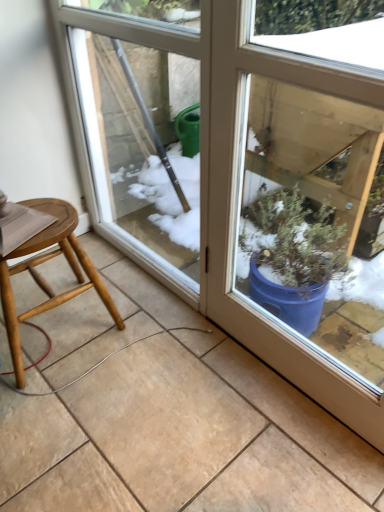
Question: Could you tell me if light wood stool at lower left is facing transparent glass screen door at center?

Choices:
 (A) no
 (B) yes

Answer: (A)

Question: Is light wood stool at lower left facing away from transparent glass screen door at center?

Choices:
 (A) yes
 (B) no

Answer: (B)

Question: From a real-world perspective, is light wood stool at lower left positioned under transparent glass screen door at center based on gravity?

Choices:
 (A) yes
 (B) no

Answer: (A)

Question: Is light wood stool at lower left shorter than transparent glass screen door at center?

Choices:
 (A) no
 (B) yes

Answer: (B)

Question: Considering the relative sizes of light wood stool at lower left and transparent glass screen door at center in the image provided, is light wood stool at lower left wider than transparent glass screen door at center?

Choices:
 (A) no
 (B) yes

Answer: (B)

Question: Can you confirm if light wood stool at lower left is positioned to the right of transparent glass screen door at center?

Choices:
 (A) yes
 (B) no

Answer: (B)

Question: From a real-world perspective, is transparent glass screen door at center located beneath light wood stool at lower left?

Choices:
 (A) no
 (B) yes

Answer: (A)

Question: Can we say transparent glass screen door at center lies outside light wood stool at lower left?

Choices:
 (A) no
 (B) yes

Answer: (B)

Question: From the image's perspective, would you say transparent glass screen door at center is positioned over light wood stool at lower left?

Choices:
 (A) no
 (B) yes

Answer: (B)

Question: Is light wood stool at lower left surrounded by transparent glass screen door at center?

Choices:
 (A) no
 (B) yes

Answer: (A)

Question: Does transparent glass screen door at center have a smaller size compared to light wood stool at lower left?

Choices:
 (A) yes
 (B) no

Answer: (B)

Question: Can you confirm if transparent glass screen door at center is wider than light wood stool at lower left?

Choices:
 (A) yes
 (B) no

Answer: (B)

Question: Based on their positions, is light wood stool at lower left located to the left or right of transparent glass screen door at center?

Choices:
 (A) right
 (B) left

Answer: (B)